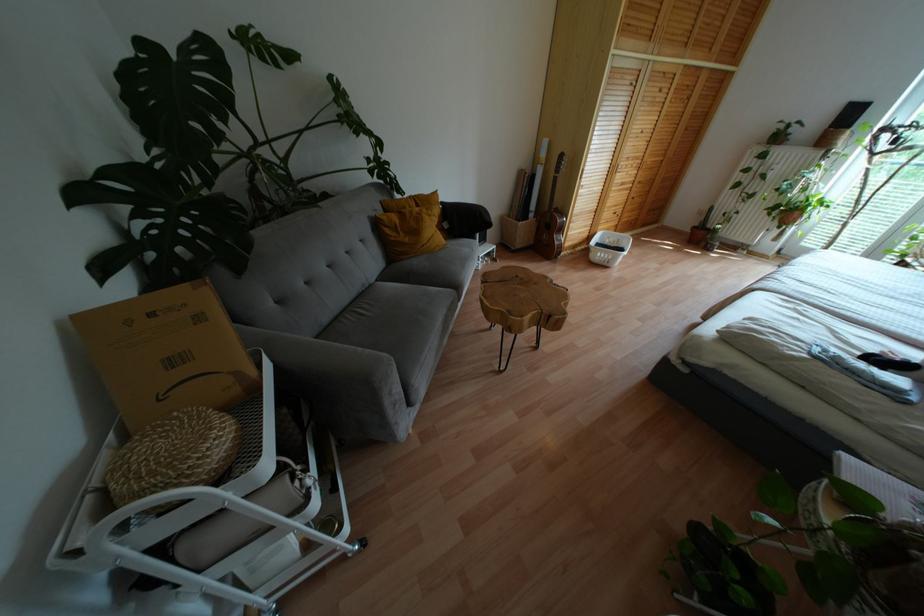
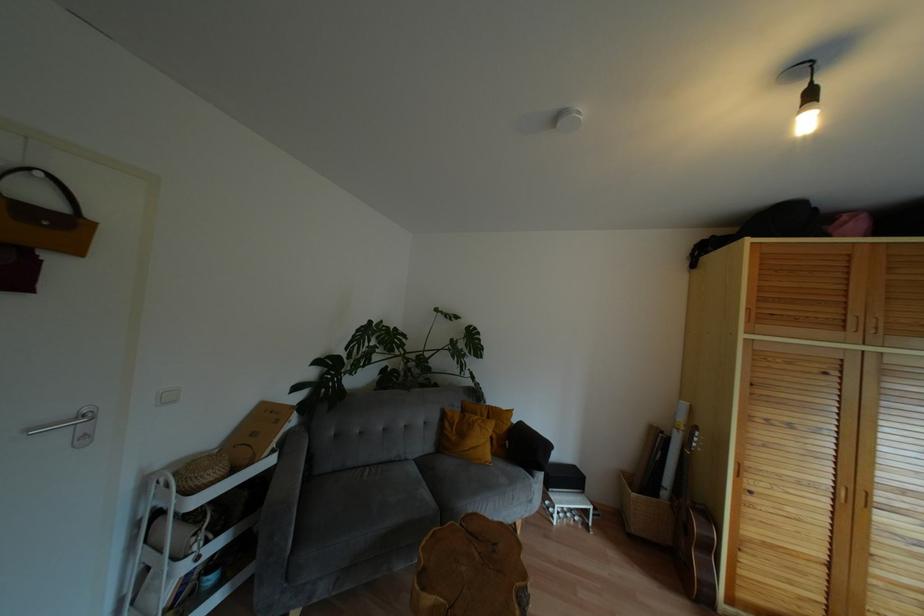
In the second image, find the point that corresponds to pixel 560 229 in the first image.

(710, 548)